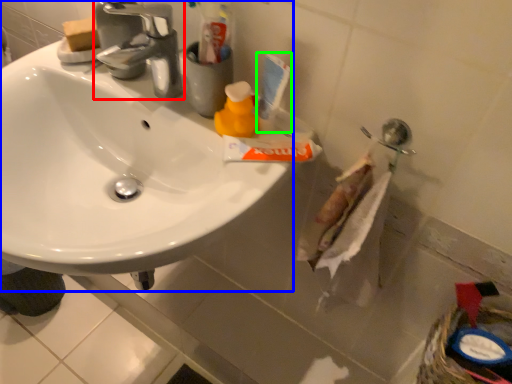
Question: Which object is the closest to the tap (highlighted by a red box)? Choose among these: sink (highlighted by a blue box) or toiletry (highlighted by a green box).

Choices:
 (A) sink
 (B) toiletry

Answer: (A)